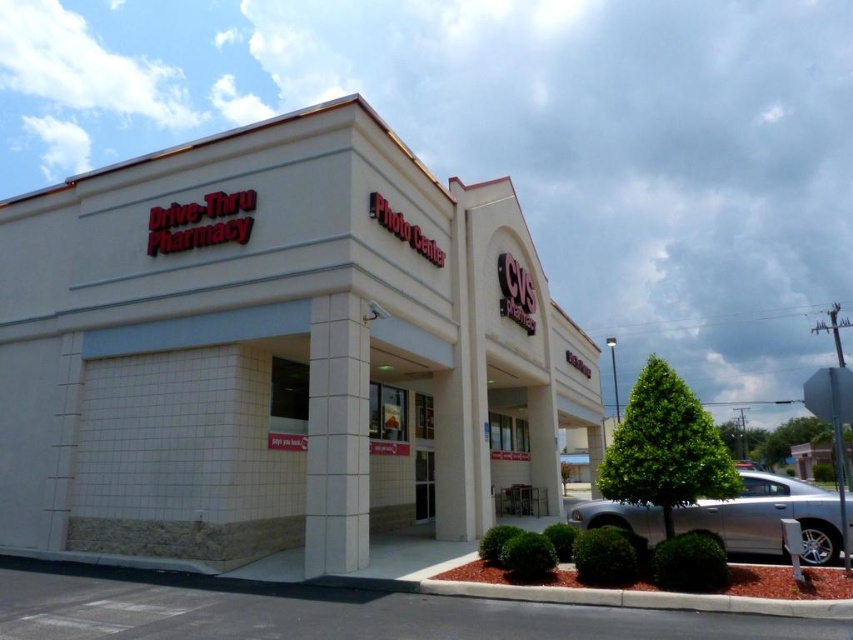
Question: Is white tile building at center further to camera compared to silver metallic sedan at lower right?

Choices:
 (A) no
 (B) yes

Answer: (B)

Question: Which of the following is the closest to the observer?

Choices:
 (A) white tile building at center
 (B) silver metallic sedan at lower right

Answer: (B)

Question: Does white tile building at center come behind silver metallic sedan at lower right?

Choices:
 (A) no
 (B) yes

Answer: (B)

Question: Can you confirm if white tile building at center is wider than silver metallic sedan at lower right?

Choices:
 (A) yes
 (B) no

Answer: (A)